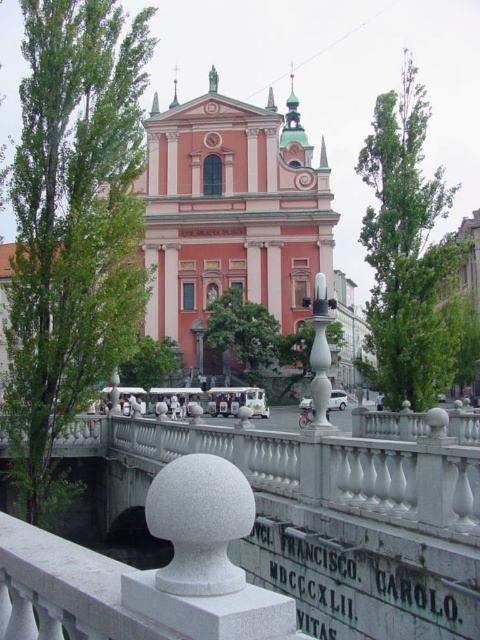
Can you confirm if white stone balustrade at center is positioned below matte pink building at center?

Correct, white stone balustrade at center is located below matte pink building at center.

Who is shorter, white stone balustrade at center or matte pink building at center?

With less height is white stone balustrade at center.

Is point (470, 454) behind point (172, 164)?

No, (470, 454) is in front of (172, 164).

The width and height of the screenshot is (480, 640). In order to click on white stone balustrade at center in this screenshot , I will do `click(333, 513)`.

Does point (296, 579) lie in front of point (261, 403)?

Yes, it is in front of point (261, 403).

Which is more to the left, white stone balustrade at center or metallic silver car at center?

metallic silver car at center is more to the left.

What do you see at coordinates (333, 513) in the screenshot? I see `white stone balustrade at center` at bounding box center [333, 513].

In order to click on white stone balustrade at center in this screenshot , I will do `click(333, 513)`.

Does matte pink building at center have a greater height compared to white glossy car at center?

Indeed, matte pink building at center has a greater height compared to white glossy car at center.

Is matte pink building at center shorter than white glossy car at center?

Incorrect, matte pink building at center's height does not fall short of white glossy car at center's.

Where is `matte pink building at center`? matte pink building at center is located at coordinates (239, 220).